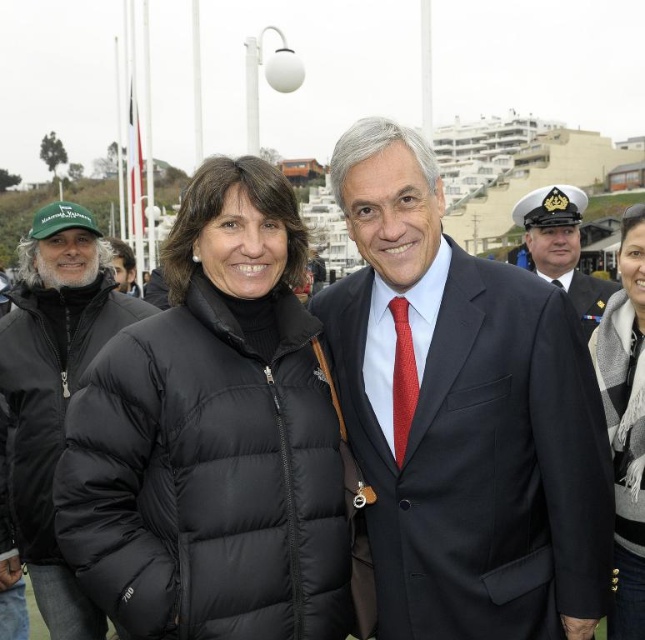
Question: Does matte black suit at center have a greater width compared to white uniform at center?

Choices:
 (A) no
 (B) yes

Answer: (A)

Question: Among these objects, which one is nearest to the camera?

Choices:
 (A) dark blue woolen suit at center
 (B) black wool scarf at right
 (C) white uniform at center
 (D) black puffer jacket at center

Answer: (D)

Question: Observing the image, what is the correct spatial positioning of black puffer jacket at left in reference to matte black jacket at left?

Choices:
 (A) above
 (B) below

Answer: (B)

Question: Which object is the closest to the black puffer jacket at center?

Choices:
 (A) matte black jacket at left
 (B) dark blue woolen suit at center
 (C) black puffer jacket at left
 (D) white uniform at center

Answer: (C)

Question: Which object appears farthest from the camera in this image?

Choices:
 (A) black wool scarf at right
 (B) matte black suit at center

Answer: (A)

Question: Can you confirm if black puffer jacket at left is thinner than white uniform at center?

Choices:
 (A) yes
 (B) no

Answer: (A)